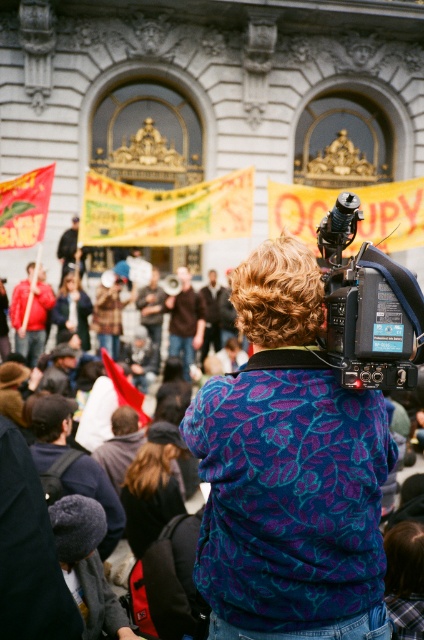
Who is more distant from viewer, (290,285) or (195,209)?

Positioned behind is point (195,209).

Can you confirm if purple leaf-patterned sweater at center is taller than yellow/yellowish paper banner at upper center?

Yes, purple leaf-patterned sweater at center is taller than yellow/yellowish paper banner at upper center.

Where is `purple leaf-patterned sweater at center`? This screenshot has height=640, width=424. purple leaf-patterned sweater at center is located at coordinates (289, 472).

Between point (318, 227) and point (220, 234), which one is positioned behind?

Positioned behind is point (318, 227).

Who is more distant from viewer, [348,198] or [86,202]?

The point [86,202] is behind.

Identify the location of black plastic video camera at upper right. This screenshot has height=640, width=424. (368, 307).

Is purple leaf-patterned sweater at center smaller than black plastic video camera at upper right?

Actually, purple leaf-patterned sweater at center might be larger than black plastic video camera at upper right.

Can you confirm if purple leaf-patterned sweater at center is thinner than black plastic video camera at upper right?

No.

The image size is (424, 640). What are the coordinates of `purple leaf-patterned sweater at center` in the screenshot? It's located at (289, 472).

Find the location of a particular element. This screenshot has width=424, height=640. purple leaf-patterned sweater at center is located at coordinates (289, 472).